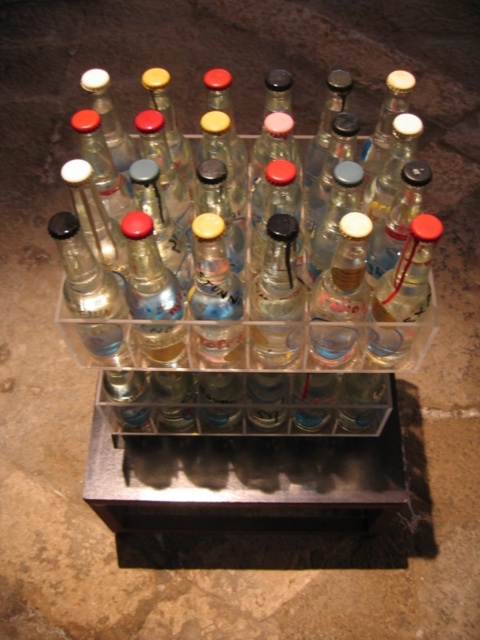
Between clear glass bottles at center and clear glass bottle at center, which one is positioned lower?

Positioned lower is clear glass bottles at center.

Can you confirm if clear glass bottles at center is thinner than clear glass bottle at center?

No.

Measure the distance between clear glass bottles at center and camera.

29.55 inches

Where is `clear glass bottles at center`? Image resolution: width=480 pixels, height=640 pixels. clear glass bottles at center is located at coordinates (249, 298).